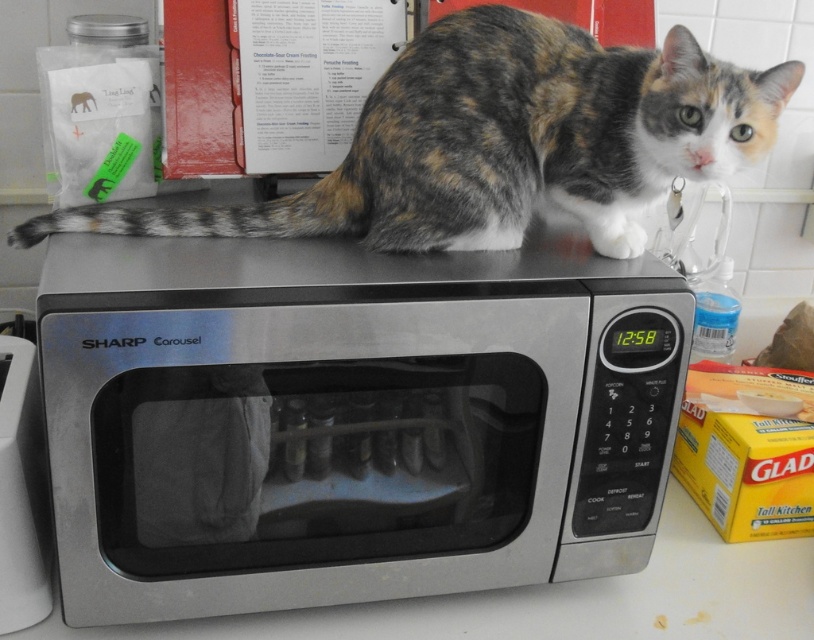
You are standing in front of the microwave and see two points marked on the floor. The first point is at coordinate point (x=379, y=204) and the second is at point (x=38, y=404). Which point is closer to you?

Point (x=379, y=204) is closer to the camera than point (x=38, y=404), so the first point is closer to you.

In the scene shown: You are a delivery person who just arrived at the house. You notice a satin silver microwave at upper center and a calico fur cat at upper center. Which object is positioned more to the left?

The satin silver microwave at upper center is to the left of calico fur cat at upper center, so the microwave is positioned more to the left.